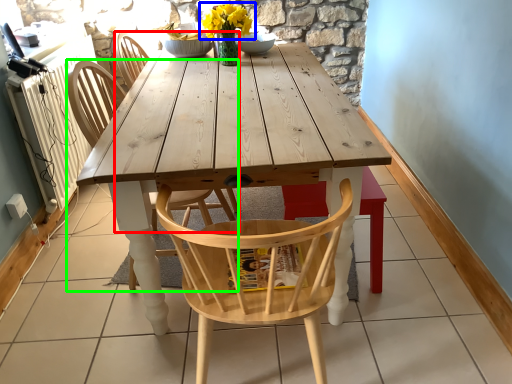
Question: Considering the real-world distances, which object is farthest from chair (highlighted by a red box)? flower (highlighted by a blue box) or chair (highlighted by a green box)?

Choices:
 (A) flower
 (B) chair

Answer: (B)